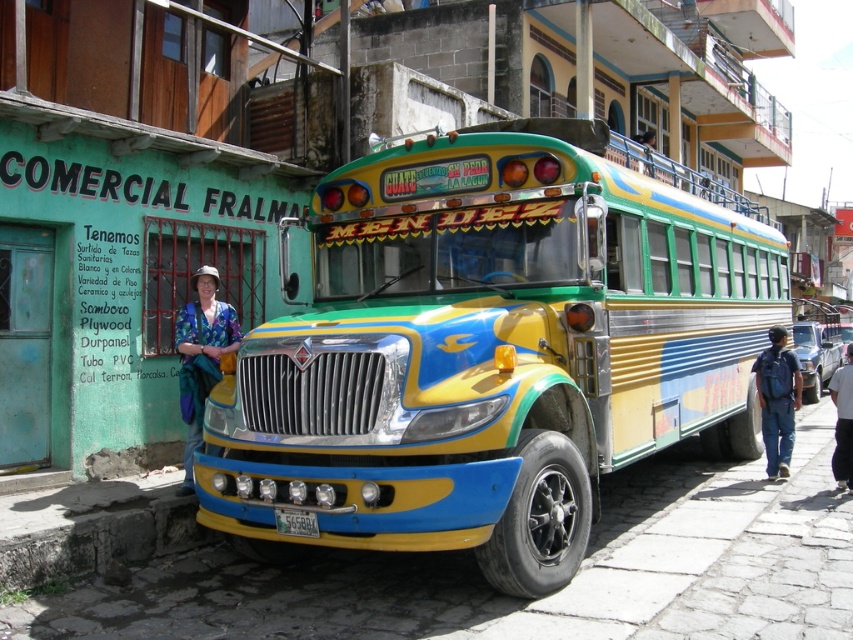
Question: Where is shiny metallic bus at center located in relation to concrete at lower left in the image?

Choices:
 (A) right
 (B) left

Answer: (A)

Question: Can you confirm if blue jeans at lower right is positioned below black fabric pants at lower right?

Choices:
 (A) no
 (B) yes

Answer: (A)

Question: Which of the following is the farthest from the observer?

Choices:
 (A) (676, 252)
 (B) (192, 307)
 (C) (778, 324)
 (D) (184, 506)

Answer: (C)

Question: Among these objects, which one is nearest to the camera?

Choices:
 (A) shiny metallic bus at center
 (B) blue printed shirt at center
 (C) blue jeans at lower right

Answer: (A)

Question: Which is nearer to the concrete at lower left?

Choices:
 (A) blue printed shirt at center
 (B) blue jeans at lower right

Answer: (A)

Question: Considering the relative positions of concrete at lower left and blue printed shirt at center in the image provided, where is concrete at lower left located with respect to blue printed shirt at center?

Choices:
 (A) above
 (B) below

Answer: (B)